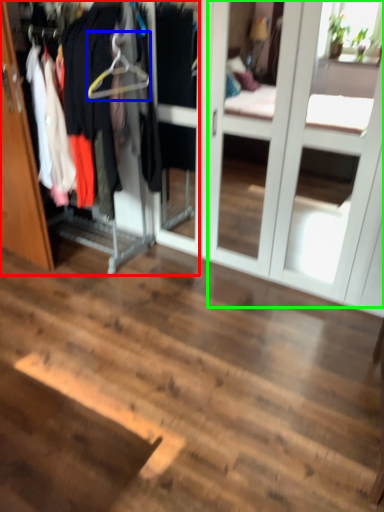
Question: Estimate the real-world distances between objects in this image. Which object is closer to closet (highlighted by a red box), hanger (highlighted by a blue box) or screen door (highlighted by a green box)?

Choices:
 (A) hanger
 (B) screen door

Answer: (A)